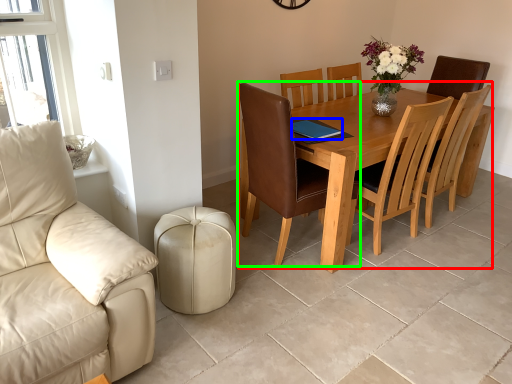
Question: Based on their relative distances, which object is nearer to kitchen & dining room table (highlighted by a red box)? Choose from pad (highlighted by a blue box) and chair (highlighted by a green box).

Choices:
 (A) pad
 (B) chair

Answer: (B)